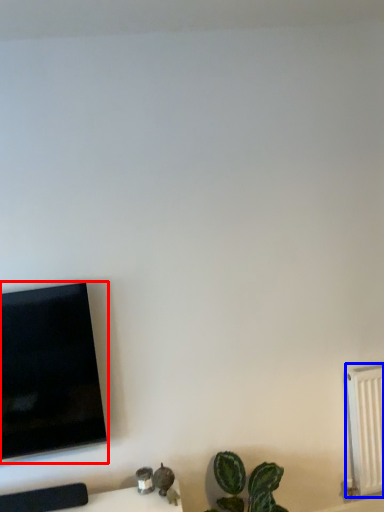
Question: Which object appears farthest to the camera in this image, television (highlighted by a red box) or radiator (highlighted by a blue box)?

Choices:
 (A) television
 (B) radiator

Answer: (B)